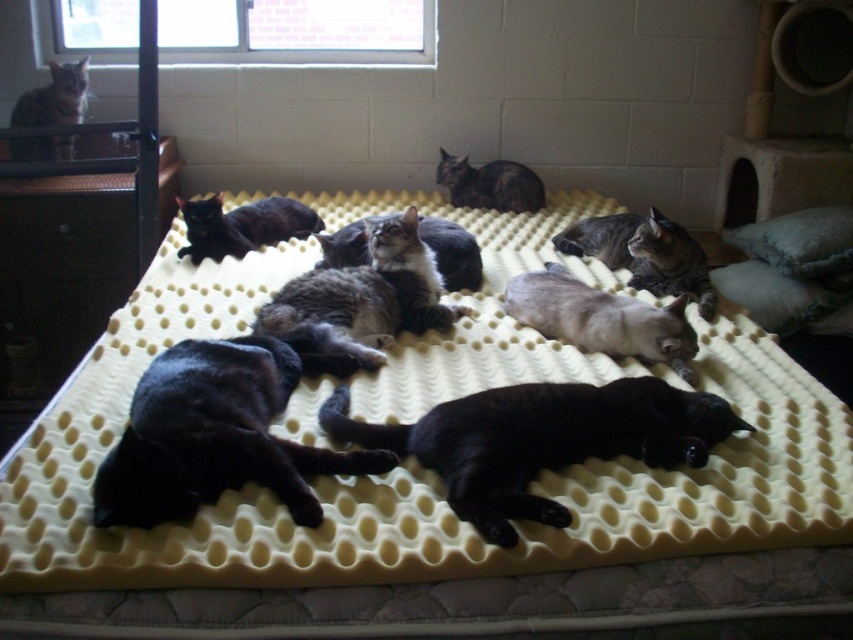
Consider the image. Can you confirm if gray fabric pillow at upper right is shorter than black fur cat at upper left?

Correct, gray fabric pillow at upper right is not as tall as black fur cat at upper left.

Does point (762, 248) come closer to viewer compared to point (270, 227)?

That is True.

Where is `gray fabric pillow at upper right`? This screenshot has width=853, height=640. gray fabric pillow at upper right is located at coordinates (799, 241).

Does yellow foam mattress at center appear over black fur cat at upper left?

No.

Does point (409, 621) come closer to viewer compared to point (292, 198)?

Yes, it is in front of point (292, 198).

The width and height of the screenshot is (853, 640). In order to click on yellow foam mattress at center in this screenshot , I will do `click(432, 513)`.

Between gray tabby cat at upper left and black fur cat at center, which one appears on the left side from the viewer's perspective?

Positioned to the left is gray tabby cat at upper left.

Which is in front, point (12, 157) or point (491, 209)?

Point (12, 157)

Which is in front, point (15, 140) or point (437, 179)?

Positioned in front is point (15, 140).

I want to click on gray tabby cat at upper left, so click(x=54, y=97).